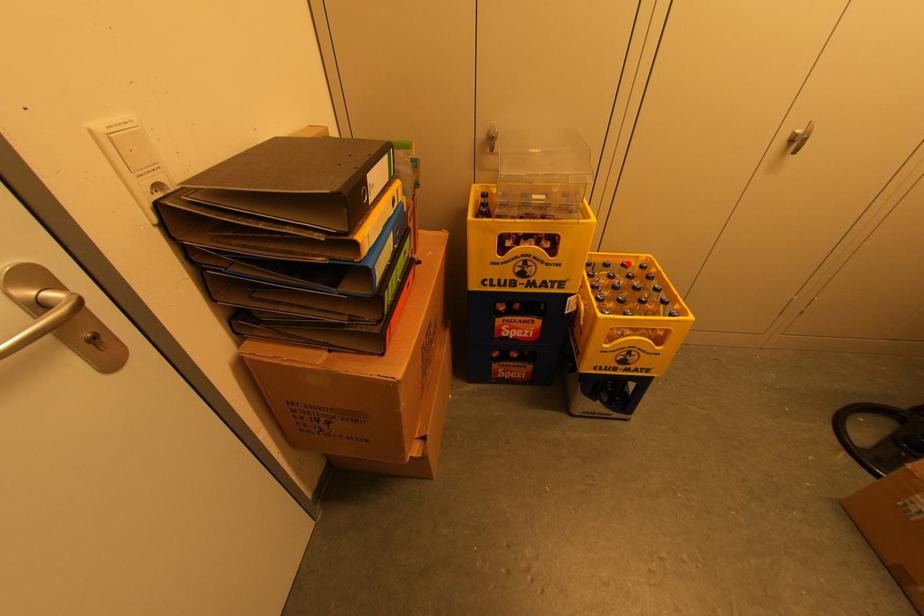
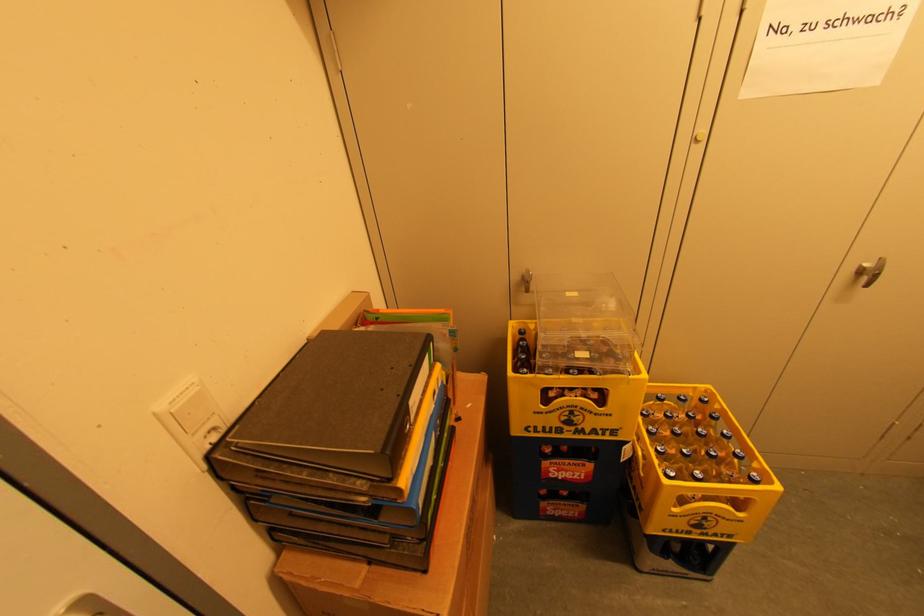
The point at the highlighted location is marked in the first image. Where is the corresponding point in the second image?

(686, 398)